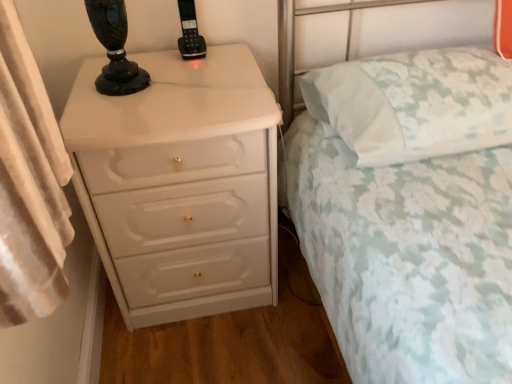
This screenshot has width=512, height=384. Identify the location of free point in front of white glossy chest of drawers at left. (213, 350).